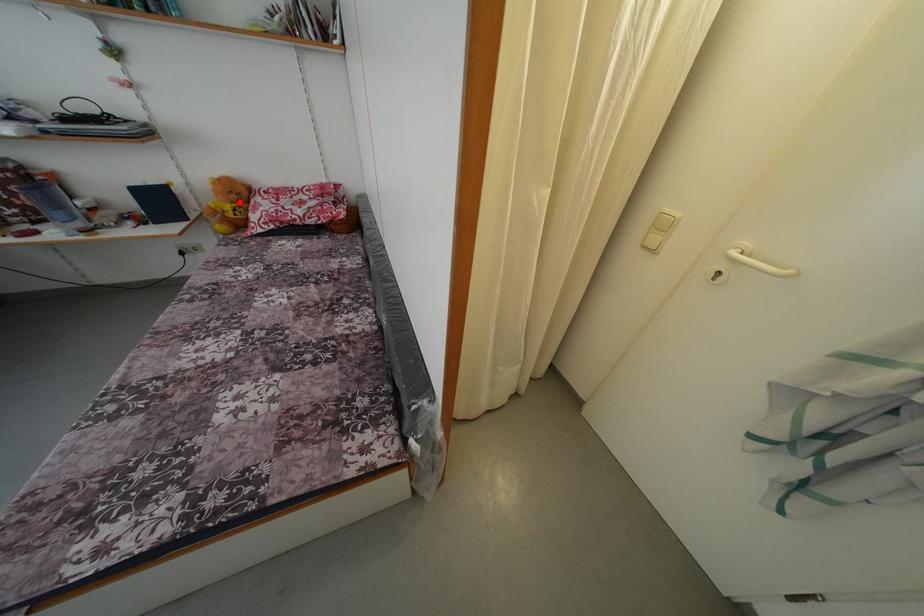
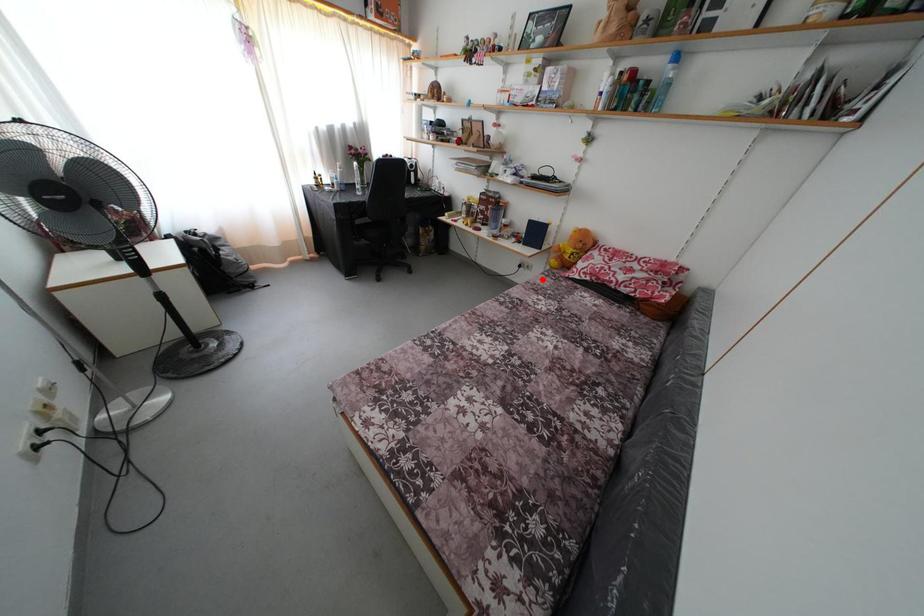
Consider the image. I am providing you with two images of the same scene from different viewpoints. A red point is marked on the first image and another point is marked on the second image. Is the red point in image1 aligned with the point shown in image2?

No